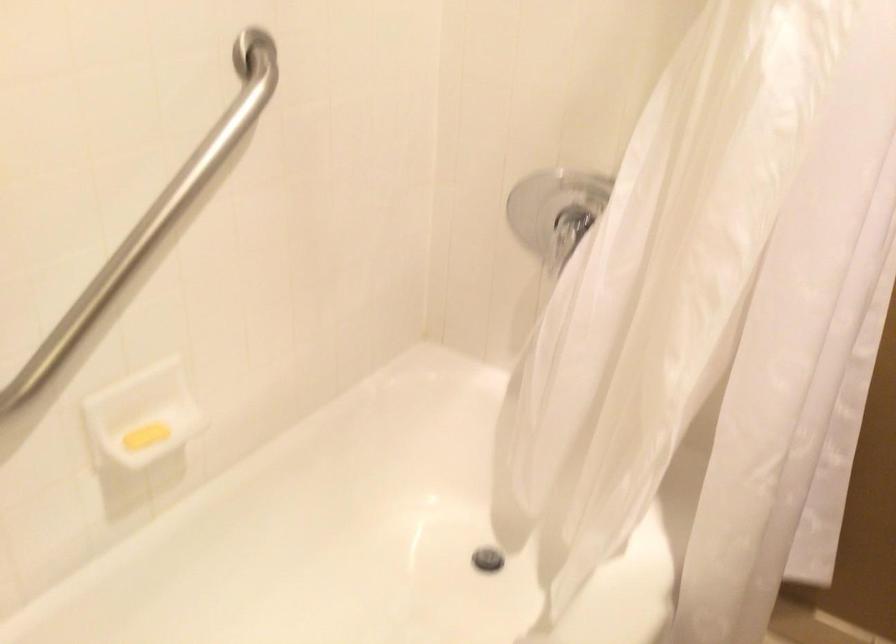
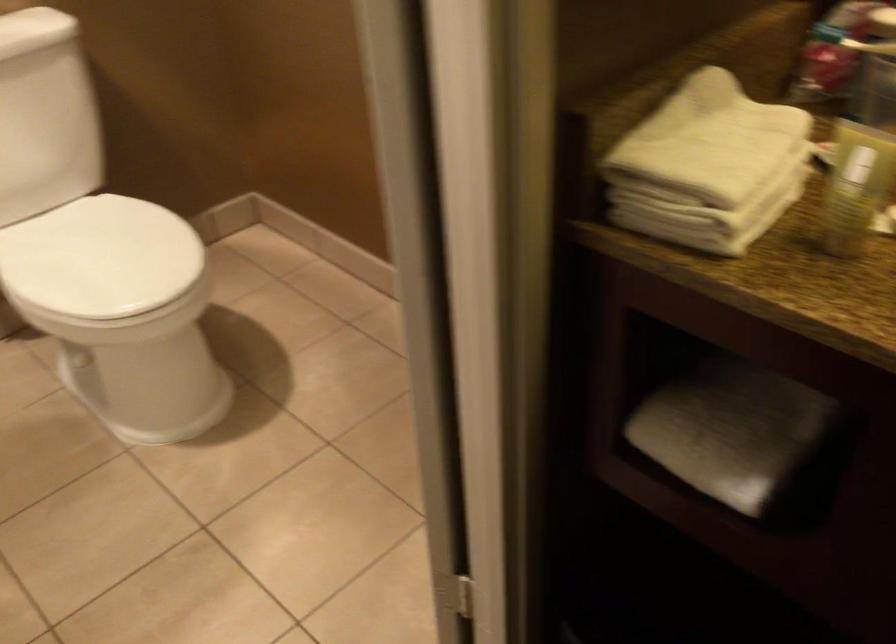
From the picture: How did the camera likely rotate?

The rotation direction of the camera is right-down.